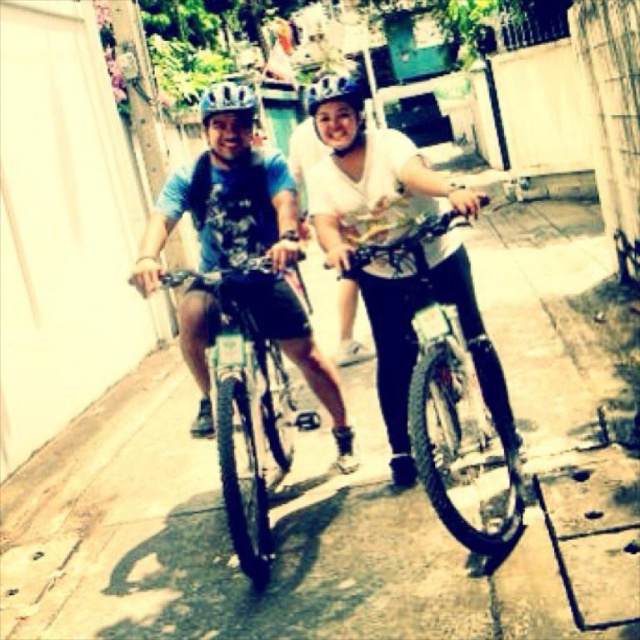
How distant is matte blue helmet at center from matte black helmet at center?

18.76 feet

Between point (305, 97) and point (205, 116), which one is positioned in front?

Point (205, 116) is in front.

Who is more forward, (332,97) or (205,93)?

Point (332,97)

At what (x,y) coordinates should I click in order to perform the action: click on matte blue helmet at center. Please return your answer as a coordinate pair (x, y). The image size is (640, 640). Looking at the image, I should click on (333, 90).

The image size is (640, 640). Describe the element at coordinates (225, 204) in the screenshot. I see `matte blue shirt at center` at that location.

Which is more to the right, matte blue shirt at center or matte blue helmet at center?

From the viewer's perspective, matte blue shirt at center appears more on the right side.

This screenshot has width=640, height=640. Describe the element at coordinates (225, 204) in the screenshot. I see `matte blue shirt at center` at that location.

Where is `matte blue shirt at center`? matte blue shirt at center is located at coordinates (225, 204).

Is smooth concrete pavement at center to the right of matte blue shirt at center from the viewer's perspective?

Yes, smooth concrete pavement at center is to the right of matte blue shirt at center.

Who is positioned more to the right, smooth concrete pavement at center or matte blue shirt at center?

smooth concrete pavement at center

The width and height of the screenshot is (640, 640). In order to click on smooth concrete pavement at center in this screenshot , I will do `click(228, 545)`.

Locate an element on the screen. Image resolution: width=640 pixels, height=640 pixels. smooth concrete pavement at center is located at coordinates click(x=228, y=545).